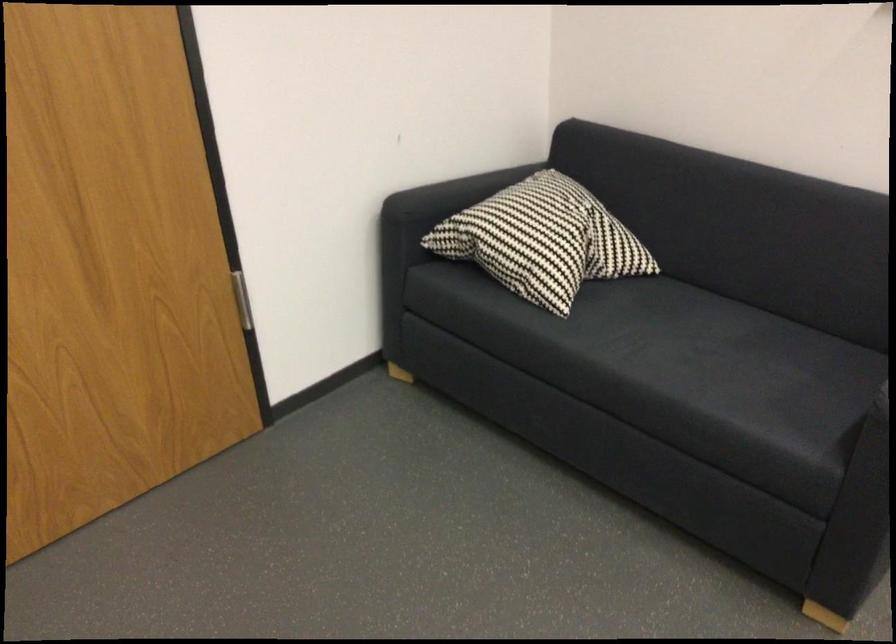
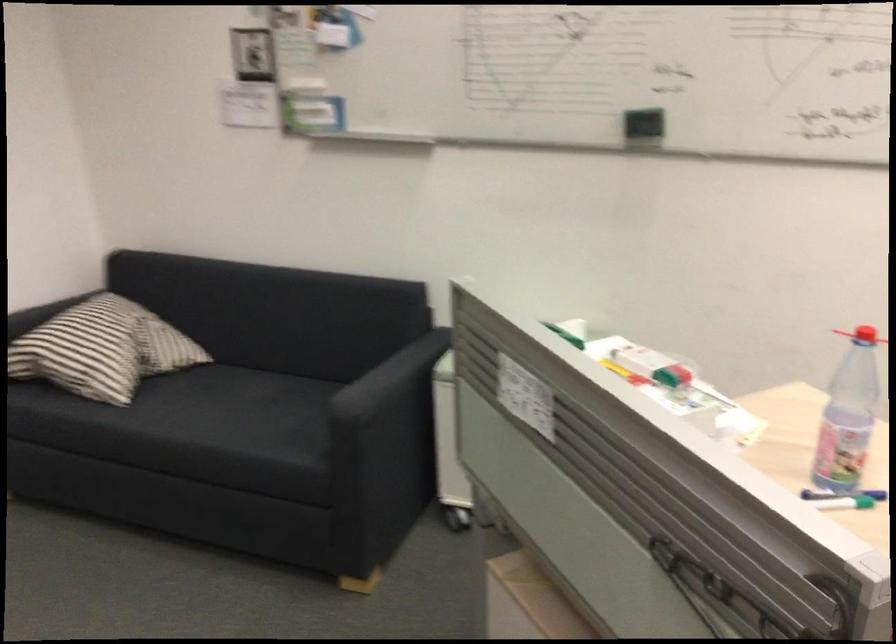
Question: The first image is from the beginning of the video and the second image is from the end. How did the camera likely rotate when shooting the video?

Choices:
 (A) Left
 (B) Right
 (C) Up
 (D) Down

Answer: (B)